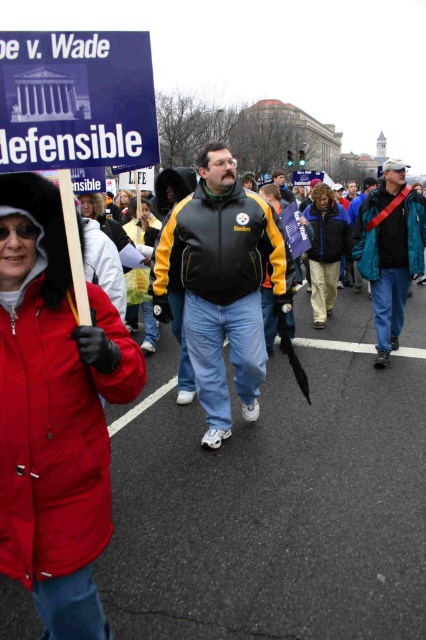
From the picture: Is teal fabric jacket at center further to the viewer compared to dark blue jacket at center?

No.

Which is in front, point (385, 296) or point (328, 228)?

Point (385, 296) is in front.

At what (x,y) coordinates should I click in order to perform the action: click on teal fabric jacket at center. Please return your answer as a coordinate pair (x, y). Looking at the image, I should click on (389, 252).

How much distance is there between black leather jacket at center and blue paper sign at upper left?

The distance of black leather jacket at center from blue paper sign at upper left is 2.44 meters.

Between point (253, 378) and point (120, 109), which one is positioned behind?

Positioned behind is point (253, 378).

The width and height of the screenshot is (426, 640). Find the location of `black leather jacket at center`. black leather jacket at center is located at coordinates (221, 284).

Between point (141, 380) and point (245, 214), which one is positioned in front?

Point (141, 380) is in front.

Who is higher up, red nylon jacket at left or leather jacket at center?

leather jacket at center is higher up.

Find the location of a particular element. This screenshot has width=426, height=640. red nylon jacket at left is located at coordinates [x=54, y=412].